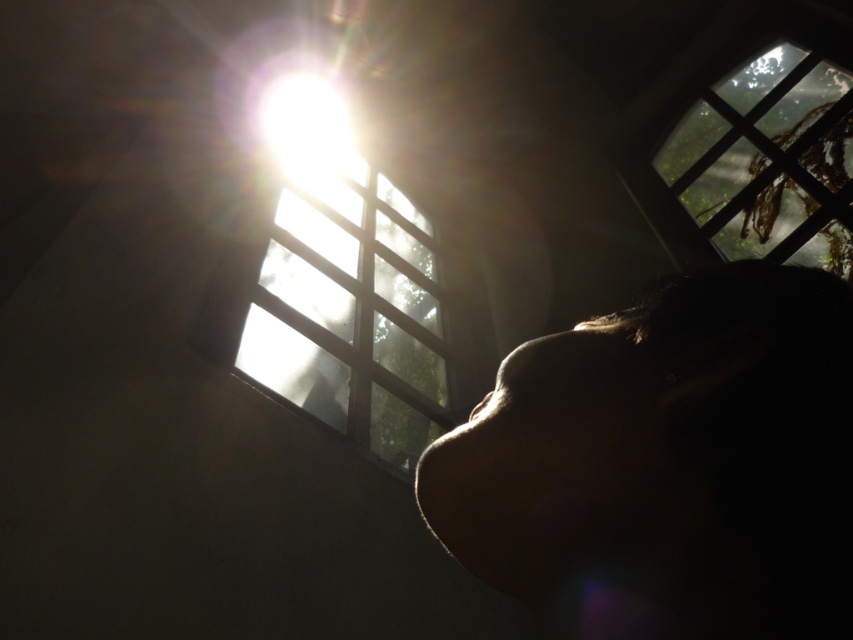
You are standing in the dimly lit room and notice the transparent glass window at upper center and the bright white light at upper center. Which object is positioned to the right side?

The transparent glass window at upper center is positioned to the right of the bright white light at upper center.

You are an interior designer assessing the lighting in the room. You notice the transparent glass window at upper center and the bright white light at upper center. Which object occupies a larger vertical space in the image?

The transparent glass window at upper center is much taller than the bright white light at upper center, so it occupies a larger vertical space in the image.

You are a photographer adjusting a camera in a dimly lit room. You notice a matte skin face at upper center and a transparent glass window at upper center. Which object is closer to the right side of the frame?

The matte skin face at upper center is positioned on the right side of the transparent glass window at upper center, so it is closer to the right side of the frame.